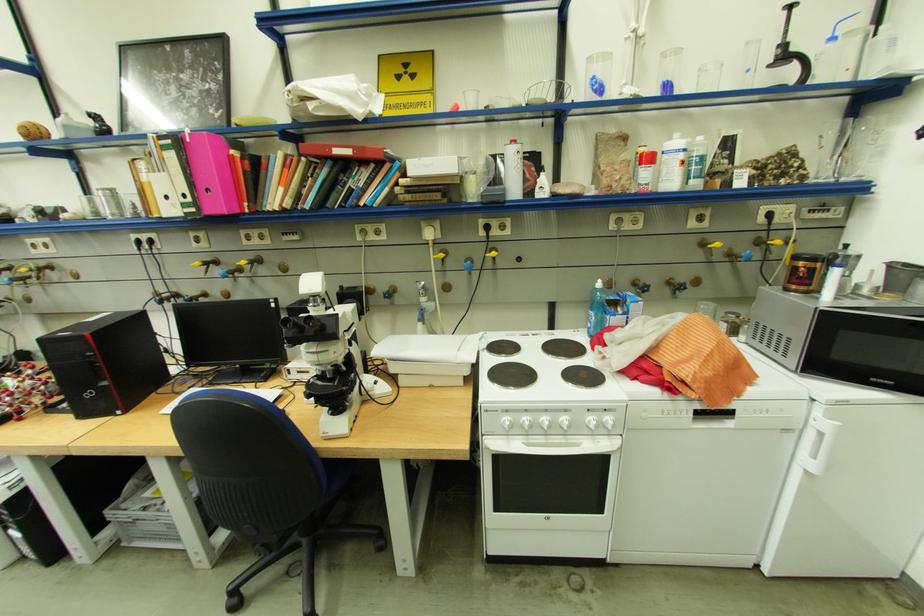
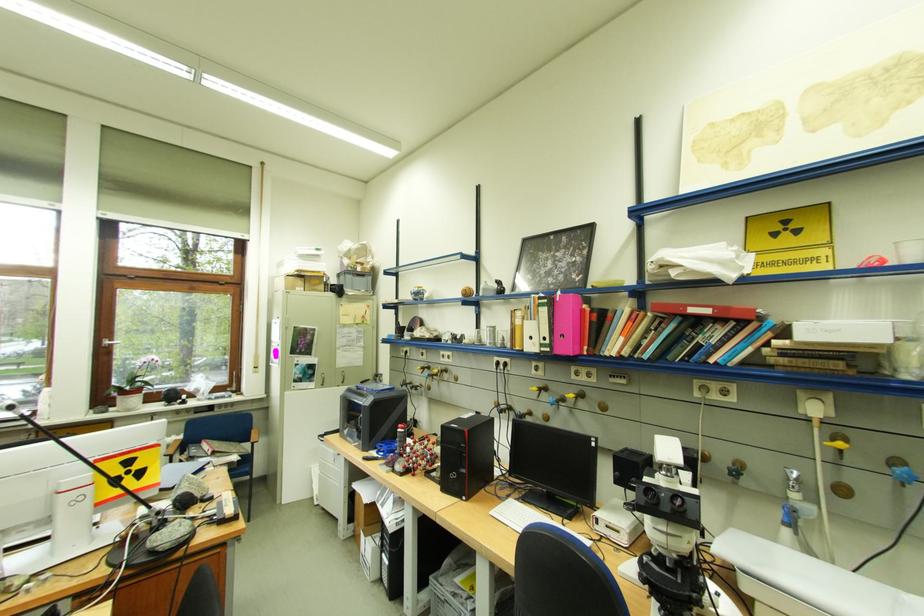
Find the pixel in the second image that matches point (381, 229) in the first image.

(724, 387)